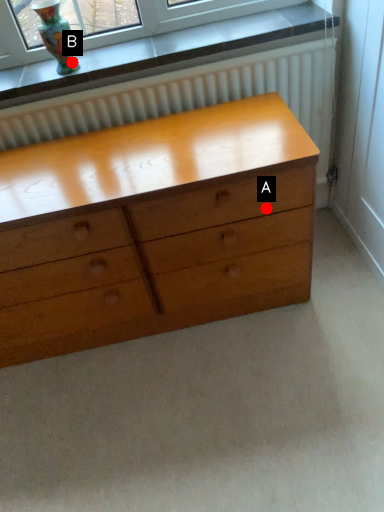
Question: Two points are circled on the image, labeled by A and B beside each circle. Which point appears farthest from the camera in this image?

Choices:
 (A) A is further
 (B) B is further

Answer: (B)